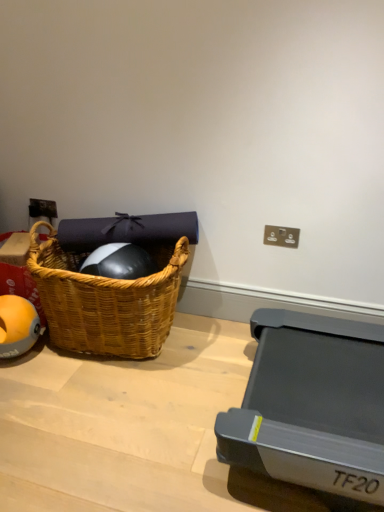
Question: Considering the relative positions of matte plastic electric outlet at upper right and orange rubber ball at left in the image provided, is matte plastic electric outlet at upper right to the right of orange rubber ball at left from the viewer's perspective?

Choices:
 (A) yes
 (B) no

Answer: (A)

Question: From the image's perspective, is matte plastic electric outlet at upper right above orange rubber ball at left?

Choices:
 (A) no
 (B) yes

Answer: (B)

Question: Is matte plastic electric outlet at upper right looking in the opposite direction of orange rubber ball at left?

Choices:
 (A) no
 (B) yes

Answer: (A)

Question: Considering the relative positions of matte plastic electric outlet at upper right and orange rubber ball at left in the image provided, is matte plastic electric outlet at upper right behind orange rubber ball at left?

Choices:
 (A) yes
 (B) no

Answer: (A)

Question: Is orange rubber ball at left surrounded by matte plastic electric outlet at upper right?

Choices:
 (A) yes
 (B) no

Answer: (B)

Question: From the image's perspective, is woven wood picnic basket at left located above or below orange rubber ball at left?

Choices:
 (A) above
 (B) below

Answer: (A)

Question: Does point (89, 300) appear closer or farther from the camera than point (13, 326)?

Choices:
 (A) closer
 (B) farther

Answer: (A)

Question: Which is correct: woven wood picnic basket at left is inside orange rubber ball at left, or outside of it?

Choices:
 (A) outside
 (B) inside

Answer: (A)

Question: Is woven wood picnic basket at left wider or thinner than orange rubber ball at left?

Choices:
 (A) thin
 (B) wide

Answer: (B)

Question: From a real-world perspective, is orange rubber ball at left physically located above or below matte plastic electric outlet at upper right?

Choices:
 (A) below
 (B) above

Answer: (A)

Question: Based on their positions, is orange rubber ball at left located to the left or right of matte plastic electric outlet at upper right?

Choices:
 (A) left
 (B) right

Answer: (A)

Question: From the image's perspective, is orange rubber ball at left located above or below matte plastic electric outlet at upper right?

Choices:
 (A) above
 (B) below

Answer: (B)

Question: Do you think orange rubber ball at left is within matte plastic electric outlet at upper right, or outside of it?

Choices:
 (A) outside
 (B) inside

Answer: (A)

Question: Is matte plastic electric outlet at upper right in front of or behind orange rubber ball at left in the image?

Choices:
 (A) behind
 (B) front

Answer: (A)

Question: Is point click(289, 237) positioned closer to the camera than point click(33, 307)?

Choices:
 (A) farther
 (B) closer

Answer: (B)